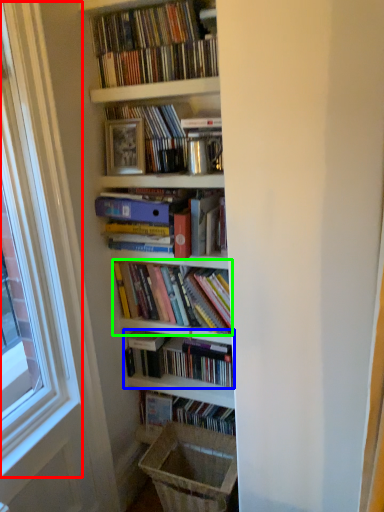
Question: Based on their relative distances, which object is nearer to window frame (highlighted by a red box)? Choose from book (highlighted by a blue box) and book (highlighted by a green box).

Choices:
 (A) book
 (B) book

Answer: (B)